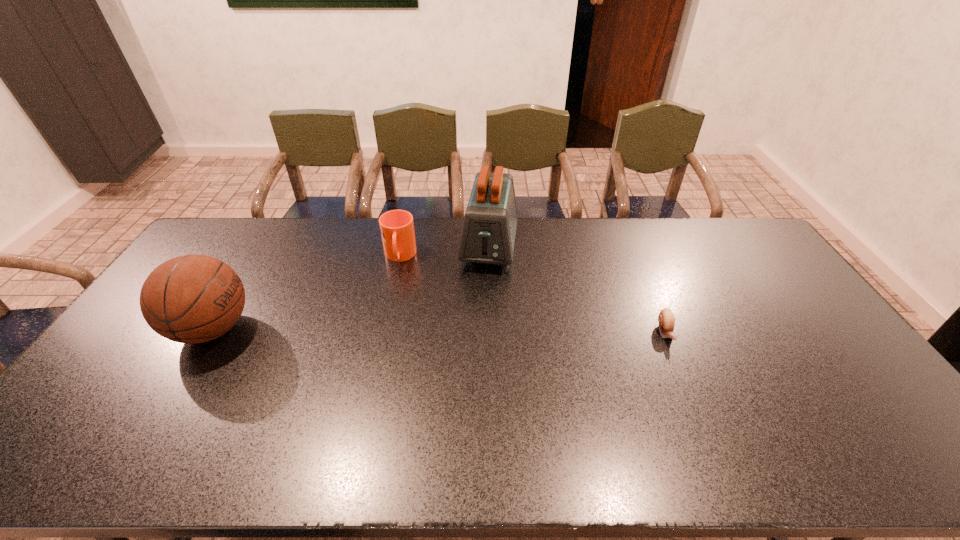
You are a GUI agent. You are given a task and a screenshot of the screen. Output one action in this format:
    pyautogui.click(x=<x>, y=<y>)
    Task: Click on the vacant point located between the rightmost object and the mug
    
    Given the screenshot: What is the action you would take?
    pyautogui.click(x=533, y=294)

The height and width of the screenshot is (540, 960). Identify the location of free space between the basketball and the escargot. (439, 330).

I want to click on free spot between the rightmost object and the third tallest object, so click(533, 294).

Find the location of a particular element. This screenshot has height=540, width=960. free space between the second tallest object and the mug is located at coordinates (306, 293).

Locate an element on the screen. Image resolution: width=960 pixels, height=540 pixels. object that is the third closest to the rightmost object is located at coordinates (190, 299).

Locate which object is the third closest to the rightmost object. Please provide its 2D coordinates. Your answer should be formatted as a tuple, i.e. [(x, y)], where the tuple contains the x and y coordinates of a point satisfying the conditions above.

[(190, 299)]